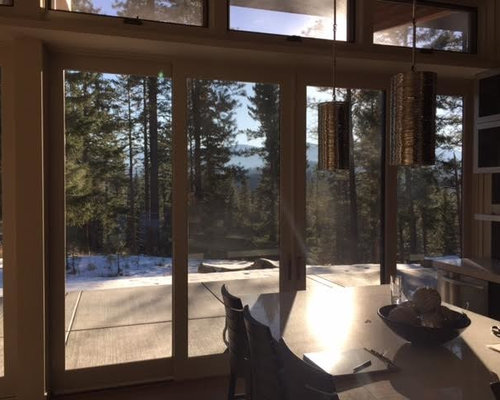
Image resolution: width=500 pixels, height=400 pixels. Identify the location of dishwasher. (465, 291).